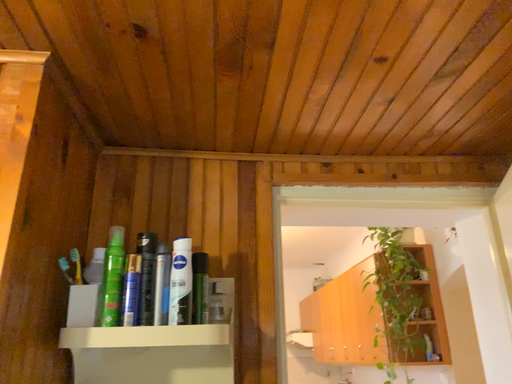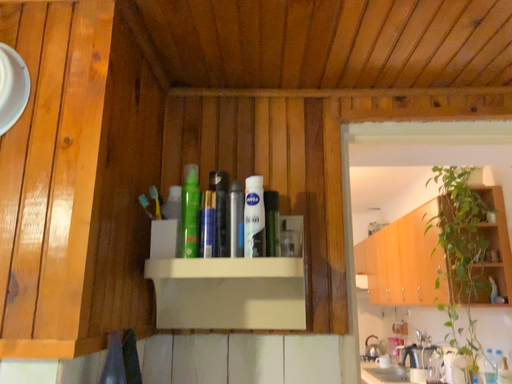
Question: Which way did the camera rotate in the video?

Choices:
 (A) rotated upward
 (B) rotated downward

Answer: (B)